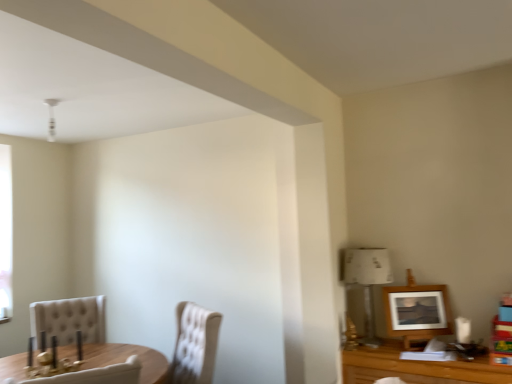
Question: Is point (75, 306) positioned closer to the camera than point (211, 344)?

Choices:
 (A) closer
 (B) farther

Answer: (B)

Question: Considering their positions, is beige tufted chair at lower left, the 1th chair when ordered from left to right, located in front of or behind tufted fabric chair at lower left, the second chair positioned from the left?

Choices:
 (A) front
 (B) behind

Answer: (B)

Question: Based on their relative distances, which object is farther from the beige tufted chair at lower left, the 1th chair when ordered from left to right?

Choices:
 (A) tufted fabric chair at lower left, marked as the 1th chair in a right-to-left arrangement
 (B) wooden picture frame at upper right
 (C) white paper lampshade at right

Answer: (B)

Question: Estimate the real-world distances between objects in this image. Which object is closer to the tufted fabric chair at lower left, marked as the 1th chair in a right-to-left arrangement?

Choices:
 (A) white paper lampshade at right
 (B) wooden picture frame at upper right
 (C) beige tufted chair at lower left, the 1th chair when ordered from left to right

Answer: (C)